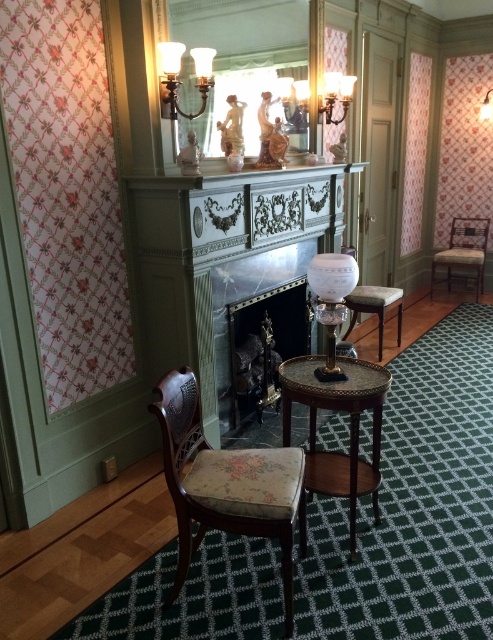
Question: Does wooden armchair at right have a lesser width compared to wooden stool at center?

Choices:
 (A) no
 (B) yes

Answer: (A)

Question: Which is nearer to the black marble fireplace at center?

Choices:
 (A) floral fabric armchair at lower left
 (B) matte brass chandelier at upper center
 (C) wooden stool at center
 (D) white marble fireplace at center

Answer: (C)

Question: Which object is the closest to the matte brass chandelier at upper center?

Choices:
 (A) floral fabric armchair at lower left
 (B) white marble fireplace at center

Answer: (B)

Question: Is rustic wood side table at center wider than wooden armchair at right?

Choices:
 (A) yes
 (B) no

Answer: (B)

Question: Can you confirm if floral fabric armchair at lower left is thinner than rustic wood side table at center?

Choices:
 (A) yes
 (B) no

Answer: (B)

Question: Which object appears closest to the camera in this image?

Choices:
 (A) matte brass chandelier at upper center
 (B) rustic wood side table at center
 (C) black marble fireplace at center
 (D) white marble fireplace at center

Answer: (B)